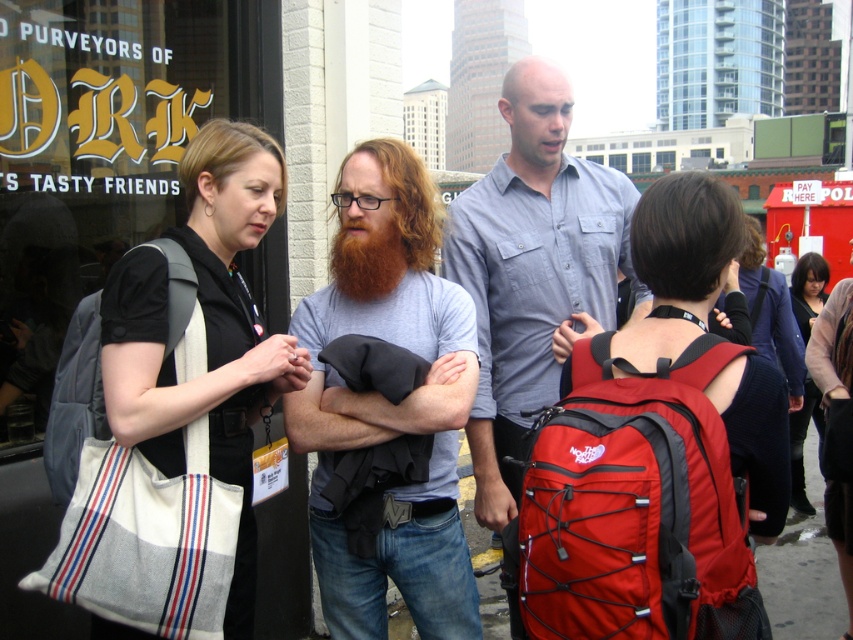
Question: Is reddish-brown beard at center bigger than black leather jacket at lower right?

Choices:
 (A) no
 (B) yes

Answer: (A)

Question: Estimate the real-world distances between objects in this image. Which object is farther from the gray cotton t-shirt at center?

Choices:
 (A) matte gray shirt at center
 (B) black leather jacket at lower right

Answer: (B)

Question: Estimate the real-world distances between objects in this image. Which object is farther from the reddish-brown beard at center?

Choices:
 (A) red fabric backpack at right
 (B) gray cotton t-shirt at center
 (C) white canvas bag at left
 (D) black leather jacket at lower right

Answer: (D)

Question: Estimate the real-world distances between objects in this image. Which object is closer to the gray cotton t-shirt at center?

Choices:
 (A) red fabric backpack at right
 (B) red fabric backpack at center
 (C) black leather jacket at lower right

Answer: (B)

Question: Is gray cotton t-shirt at center below reddish-brown beard at center?

Choices:
 (A) yes
 (B) no

Answer: (A)

Question: Does matte gray shirt at center appear on the right side of red fabric backpack at center?

Choices:
 (A) yes
 (B) no

Answer: (A)